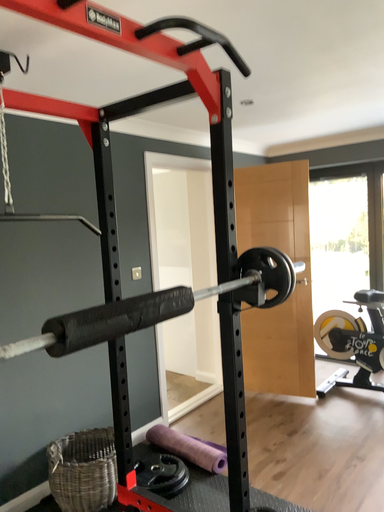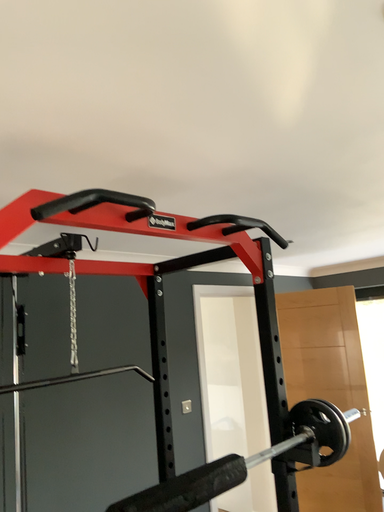
Question: Which way did the camera rotate in the video?

Choices:
 (A) rotated left
 (B) rotated right

Answer: (A)